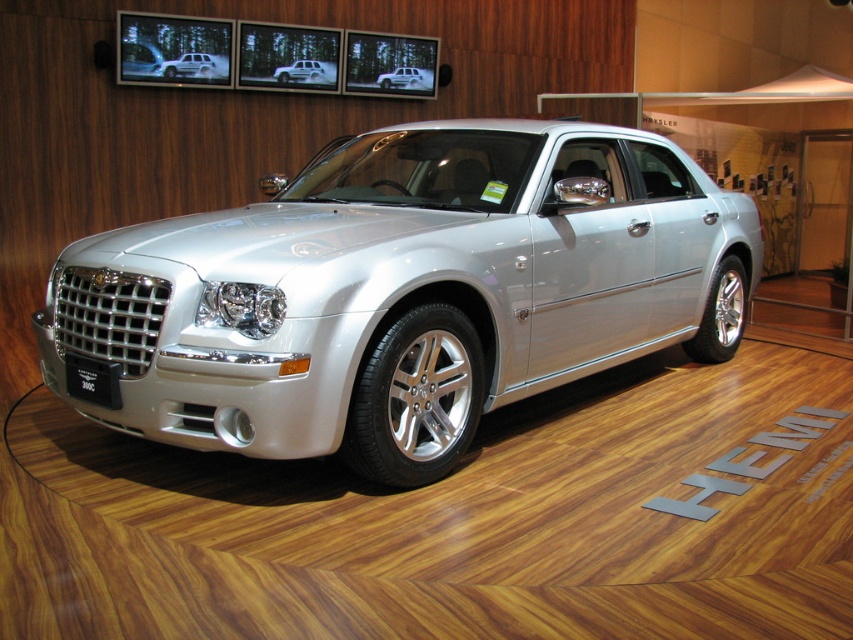
Question: Which point is farther to the camera?

Choices:
 (A) (427, 80)
 (B) (97, 400)
 (C) (190, 68)
 (D) (527, 221)

Answer: (A)

Question: Which point is farther to the camera?

Choices:
 (A) (332, 81)
 (B) (602, 225)
 (C) (93, 364)
 (D) (409, 76)

Answer: (D)

Question: Does silver metallic car at center appear on the right side of black metallic license plate at front?

Choices:
 (A) yes
 (B) no

Answer: (A)

Question: Is satin silver metallic sedan at upper center bigger than satin silver car at center?

Choices:
 (A) no
 (B) yes

Answer: (B)

Question: Which of the following is the farthest from the observer?

Choices:
 (A) (144, 397)
 (B) (381, 84)
 (C) (71, 364)
 (D) (318, 80)

Answer: (B)

Question: Considering the relative positions of black metallic license plate at front and satin silver car at center in the image provided, where is black metallic license plate at front located with respect to satin silver car at center?

Choices:
 (A) above
 (B) below

Answer: (B)